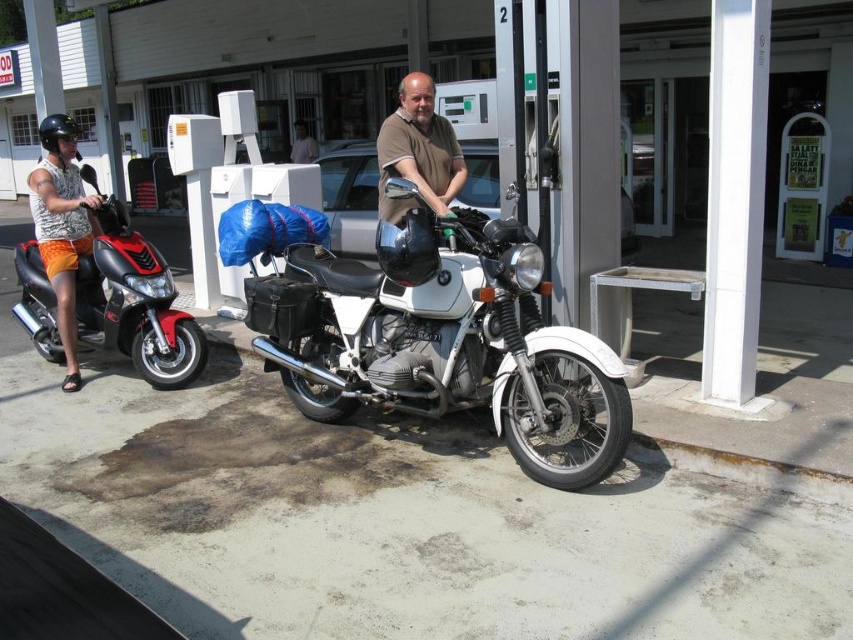
Is white matte motorcycle at center to the left of brown matte shirt at center from the viewer's perspective?

Incorrect, white matte motorcycle at center is not on the left side of brown matte shirt at center.

Where is `white matte motorcycle at center`? The width and height of the screenshot is (853, 640). white matte motorcycle at center is located at coordinates (444, 340).

Which is behind, point (480, 339) or point (418, 170)?

Point (418, 170)

At what (x,y) coordinates should I click in order to perform the action: click on white matte motorcycle at center. Please return your answer as a coordinate pair (x, y). This screenshot has width=853, height=640. Looking at the image, I should click on (444, 340).

Is point (370, 310) more distant than point (59, 156)?

No, (370, 310) is closer to viewer.

At what (x,y) coordinates should I click in order to perform the action: click on white matte motorcycle at center. Please return your answer as a coordinate pair (x, y). The width and height of the screenshot is (853, 640). Looking at the image, I should click on pos(444,340).

Where is `white matte motorcycle at center`? white matte motorcycle at center is located at coordinates (444, 340).

Can you confirm if shiny red scooter at left is thinner than light pink fabric shirt at center?

No.

In order to click on shiny red scooter at left in this screenshot , I will do `click(135, 304)`.